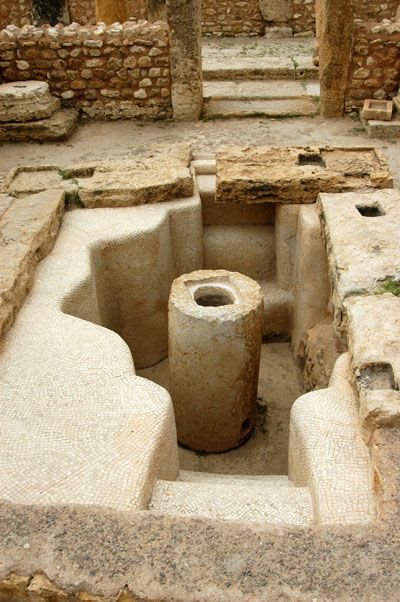
This screenshot has width=400, height=602. What are the coordinates of `doorway` in the screenshot? It's located at (179, 76), (345, 35).